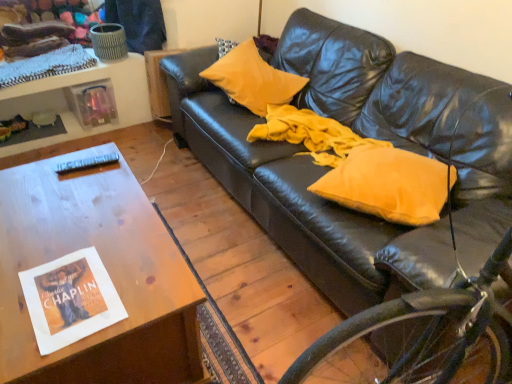
At what (x,y) coordinates should I click in order to perform the action: click on free spot above white paper magazine at lower left (from a real-world perspective). Please return your answer as a coordinate pair (x, y). Looking at the image, I should click on (65, 286).